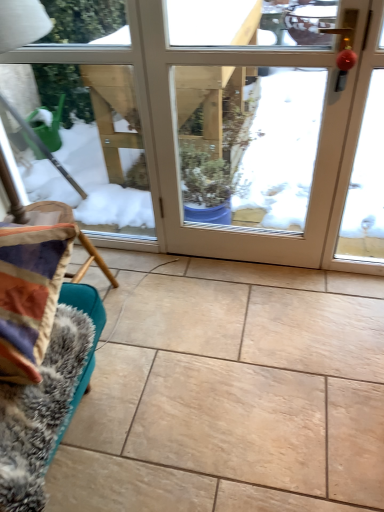
Question: Is the position of white glossy door at center less distant than that of fuzzy fabric couch at lower left?

Choices:
 (A) no
 (B) yes

Answer: (A)

Question: Considering the relative sizes of white glossy door at center and fuzzy fabric couch at lower left in the image provided, is white glossy door at center smaller than fuzzy fabric couch at lower left?

Choices:
 (A) no
 (B) yes

Answer: (A)

Question: Would you say white glossy door at center is outside fuzzy fabric couch at lower left?

Choices:
 (A) yes
 (B) no

Answer: (A)

Question: Can you confirm if white glossy door at center is thinner than fuzzy fabric couch at lower left?

Choices:
 (A) yes
 (B) no

Answer: (A)

Question: Does white glossy door at center contain fuzzy fabric couch at lower left?

Choices:
 (A) no
 (B) yes

Answer: (A)

Question: Is there a large distance between white glossy door at center and fuzzy fabric couch at lower left?

Choices:
 (A) no
 (B) yes

Answer: (B)

Question: Considering the relative sizes of fuzzy fabric couch at lower left and white glossy door at center in the image provided, is fuzzy fabric couch at lower left taller than white glossy door at center?

Choices:
 (A) no
 (B) yes

Answer: (A)

Question: Considering the relative sizes of fuzzy fabric couch at lower left and white glossy door at center in the image provided, is fuzzy fabric couch at lower left wider than white glossy door at center?

Choices:
 (A) no
 (B) yes

Answer: (B)

Question: Does fuzzy fabric couch at lower left have a lesser height compared to white glossy door at center?

Choices:
 (A) no
 (B) yes

Answer: (B)

Question: Is white glossy door at center surrounded by fuzzy fabric couch at lower left?

Choices:
 (A) yes
 (B) no

Answer: (B)

Question: Is fuzzy fabric couch at lower left further to camera compared to white glossy door at center?

Choices:
 (A) yes
 (B) no

Answer: (B)

Question: Can you confirm if fuzzy fabric couch at lower left is smaller than white glossy door at center?

Choices:
 (A) yes
 (B) no

Answer: (A)

Question: Is beige ceramic tile at center bigger than fuzzy fabric couch at lower left?

Choices:
 (A) yes
 (B) no

Answer: (A)